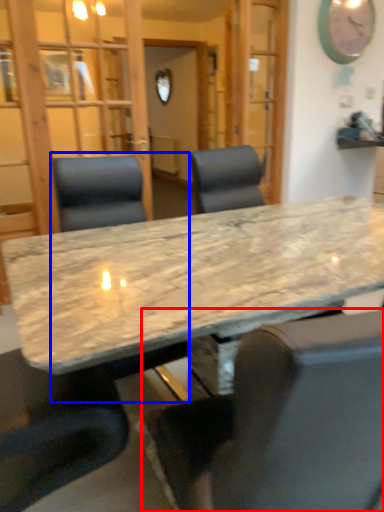
Question: Which point is further to the camera, chair (highlighted by a red box) or chair (highlighted by a blue box)?

Choices:
 (A) chair
 (B) chair

Answer: (B)